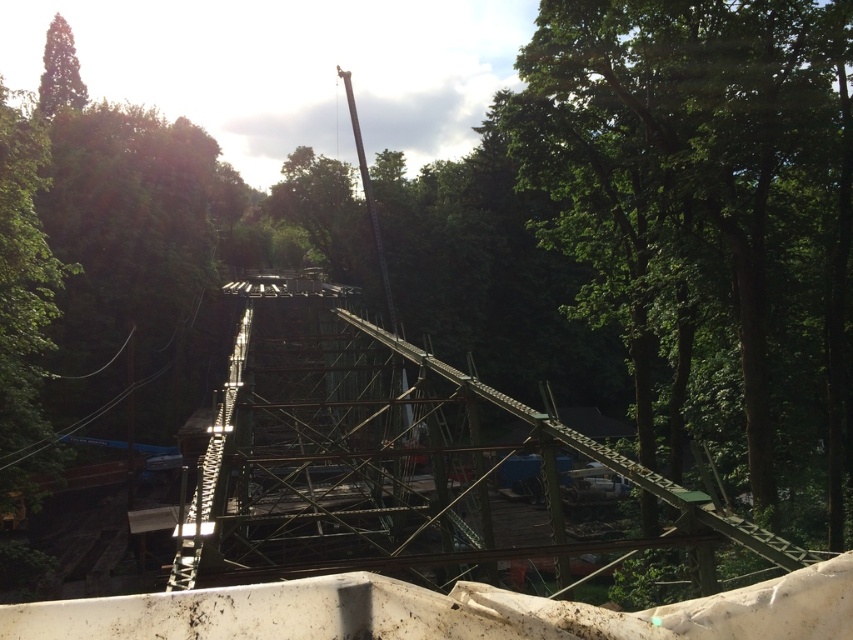
You are a construction worker standing at the edge of the construction site. You need to determine which tree has a wider spread between the green leafy tree at center and the green leafy tree at upper left. Which one is wider?

The green leafy tree at center is wider than the green leafy tree at upper left because its width surpasses the latter.